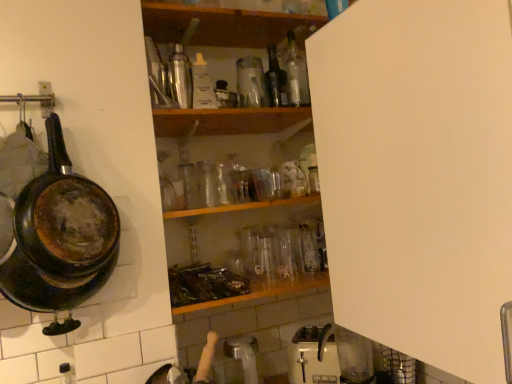
Question: Relative to rusty cast iron frying pan at left, is brushed metal thermos at upper center, which ranks as the 4th bottle in bottom-to-top order, in front or behind?

Choices:
 (A) behind
 (B) front

Answer: (A)

Question: From a real-world perspective, relative to rusty cast iron frying pan at left, is brushed metal thermos at upper center, which ranks as the 2th bottle in left-to-right order, vertically above or below?

Choices:
 (A) below
 (B) above

Answer: (B)

Question: Considering the real-world distances, which object is closest to the white matte cabinet at upper right?

Choices:
 (A) white plastic toaster at lower center
 (B) transparent glass bottle at center, acting as the 4th bottle starting from the left
 (C) translucent glass bottle at lower left, acting as the seventh bottle starting from the top
 (D) brushed metal thermos at upper center, which ranks as the 4th bottle in bottom-to-top order
 (E) transparent glass bottle at upper center, which is the 1th bottle in right-to-left order

Answer: (E)

Question: Based on their relative distances, which object is farther from the translucent glass bottle at lower left, the 1th bottle in the left-to-right sequence?

Choices:
 (A) transparent glass bottle at upper center, which is the first bottle in top-to-bottom order
 (B) white matte cabinet at upper right
 (C) brushed metal thermos at upper center, the 4th bottle viewed from the top
 (D) translucent glass bottle at center, the sixth bottle when ordered from bottom to top
 (E) transparent glass bottle at upper center, the 3th bottle in the right-to-left sequence

Answer: (A)